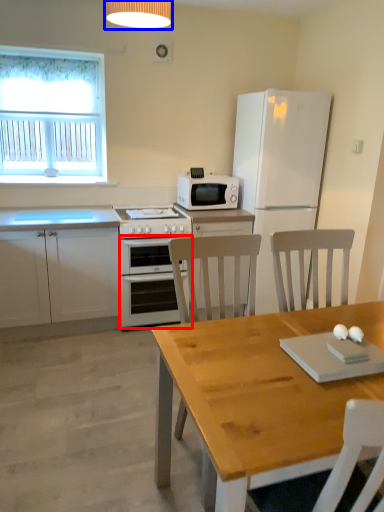
Question: Which object appears farthest to the camera in this image, oven (highlighted by a red box) or lamp (highlighted by a blue box)?

Choices:
 (A) oven
 (B) lamp

Answer: (A)